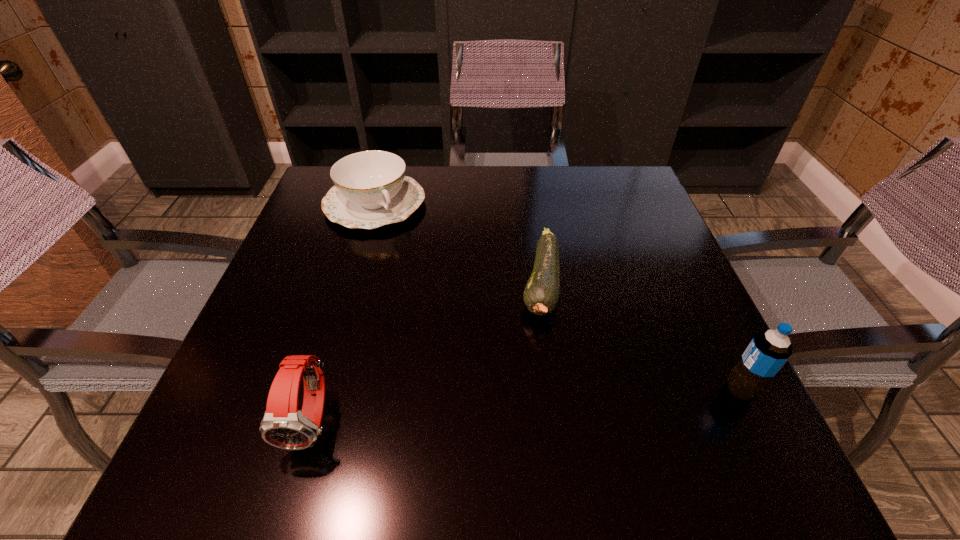
Identify the location of watch. The image size is (960, 540). (283, 426).

You are a GUI agent. You are given a task and a screenshot of the screen. Output one action in this format:
    pyautogui.click(x=<x>, y=<y>)
    Task: Click on the rightmost object
    
    Given the screenshot: What is the action you would take?
    pyautogui.click(x=768, y=351)

Locate an element on the screen. the tallest object is located at coordinates (768, 351).

Where is `the third object from left to right`? the third object from left to right is located at coordinates (541, 294).

Identify the location of the shortest object. (541, 294).

This screenshot has height=540, width=960. I want to click on chinaware, so click(x=371, y=190).

Image resolution: width=960 pixels, height=540 pixels. What are the coordinates of `the third tallest object` in the screenshot? It's located at (371, 190).

Locate an element on the screen. The height and width of the screenshot is (540, 960). vacant space located 0.390m on the back of the soda bottle is located at coordinates (667, 239).

You are a GUI agent. You are given a task and a screenshot of the screen. Output one action in this format:
    pyautogui.click(x=<x>, y=<y>)
    Task: Click on the free region located at the blossom end of the third nearest object
    The width and height of the screenshot is (960, 540).
    Given the screenshot: What is the action you would take?
    pyautogui.click(x=526, y=407)

Find the location of a particular element. The height and width of the screenshot is (540, 960). vacant space located 0.200m at the blossom end of the third nearest object is located at coordinates (522, 423).